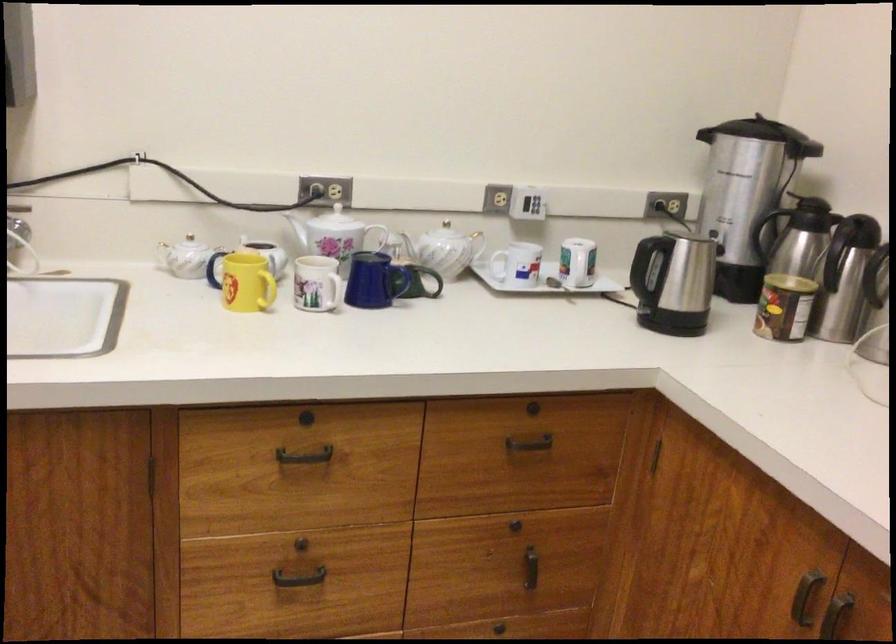
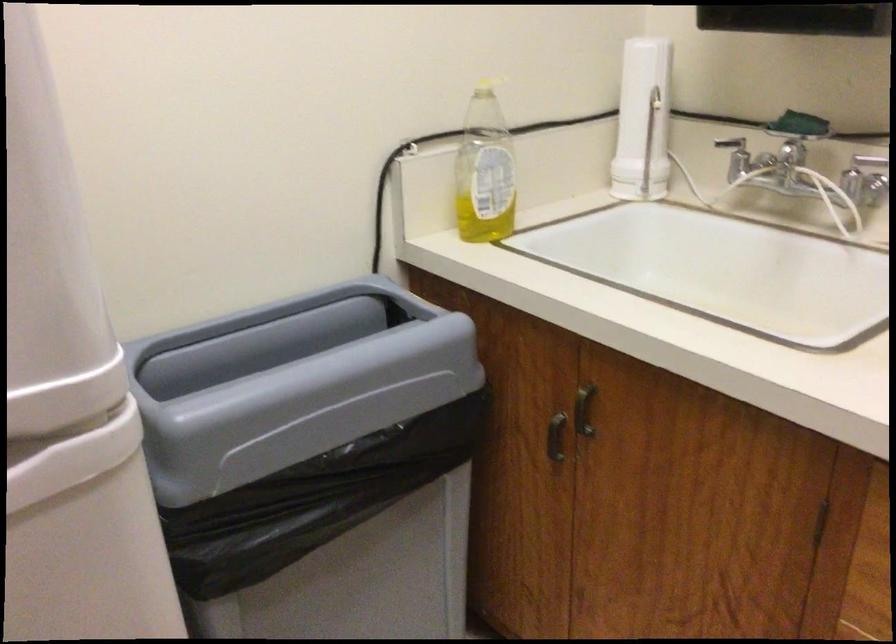
Question: How did the camera likely rotate?

Choices:
 (A) Left
 (B) Right
 (C) Up
 (D) Down

Answer: (A)